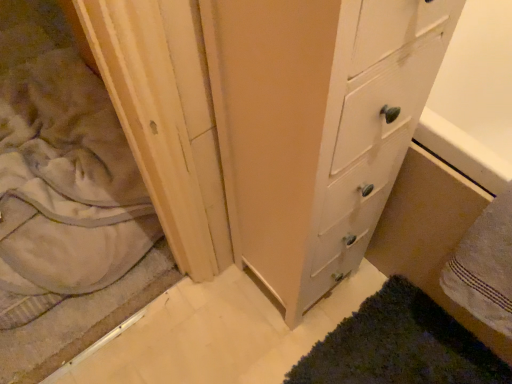
Find the location of a particular element. The height and width of the screenshot is (384, 512). vacant space that's between white wood chest of drawers at center and dark green shaggy bath mat at lower right is located at coordinates (303, 320).